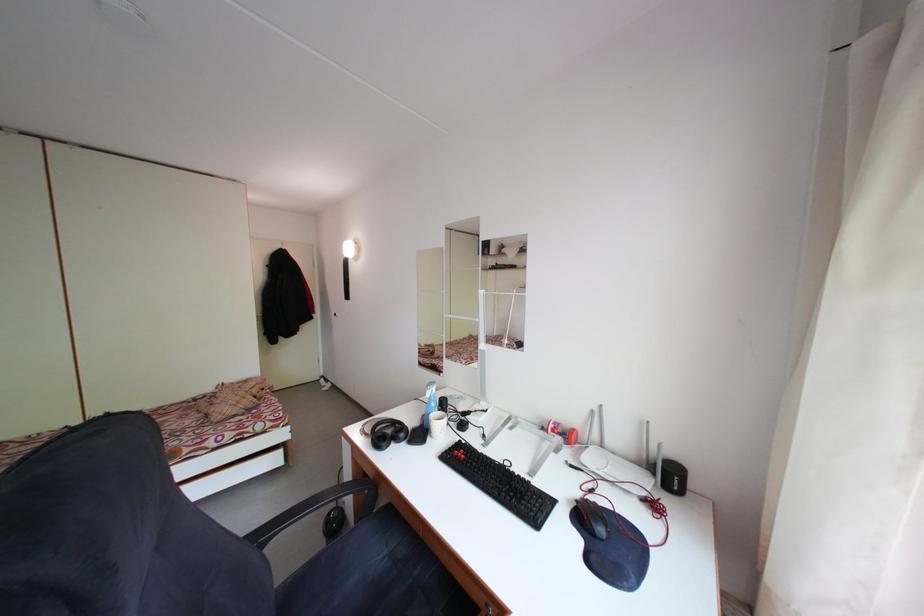
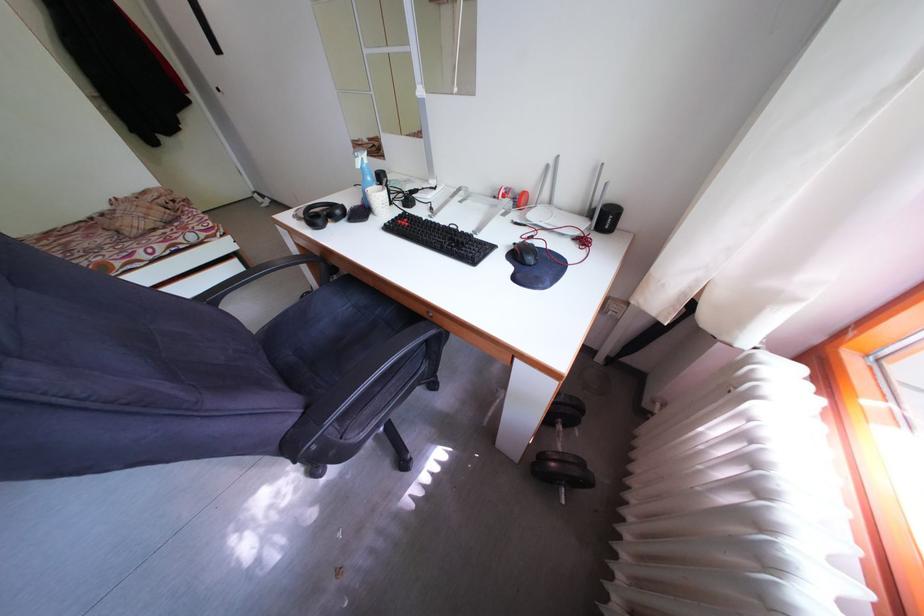
Find the pixel in the second image that matches point 588,501 in the first image.

(527, 246)